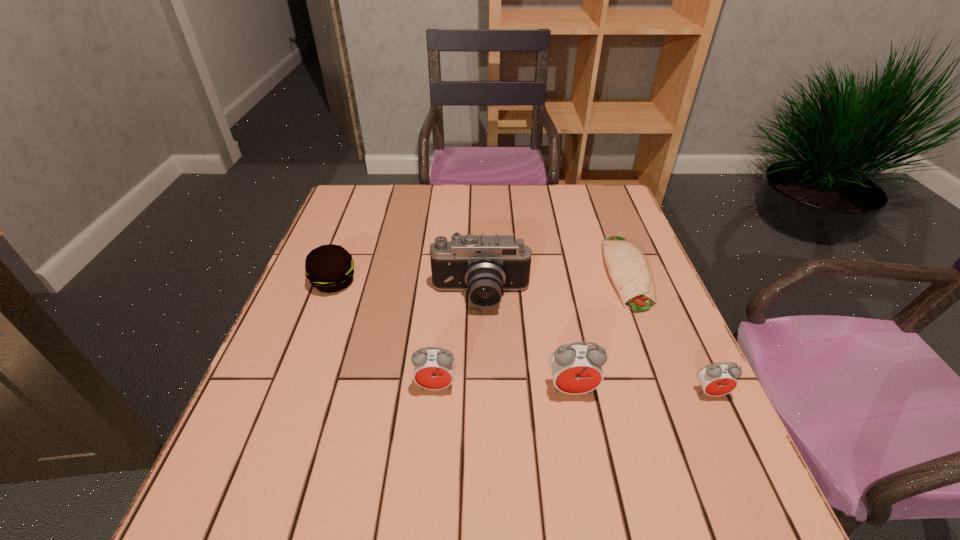
Where is `object that ranks as the fourth closest to the leftmost alarm clock`? This screenshot has width=960, height=540. object that ranks as the fourth closest to the leftmost alarm clock is located at coordinates (628, 267).

Find the location of a particular element. object that ranks as the fifth closest to the camera is located at coordinates (718, 379).

The image size is (960, 540). I want to click on alarm clock that is the closest to the camera, so click(434, 368).

Locate which alarm clock is the second closest to the burrito. Please provide its 2D coordinates. Your answer should be formatted as a tuple, i.e. [(x, y)], where the tuple contains the x and y coordinates of a point satisfying the conditions above.

[(576, 368)]